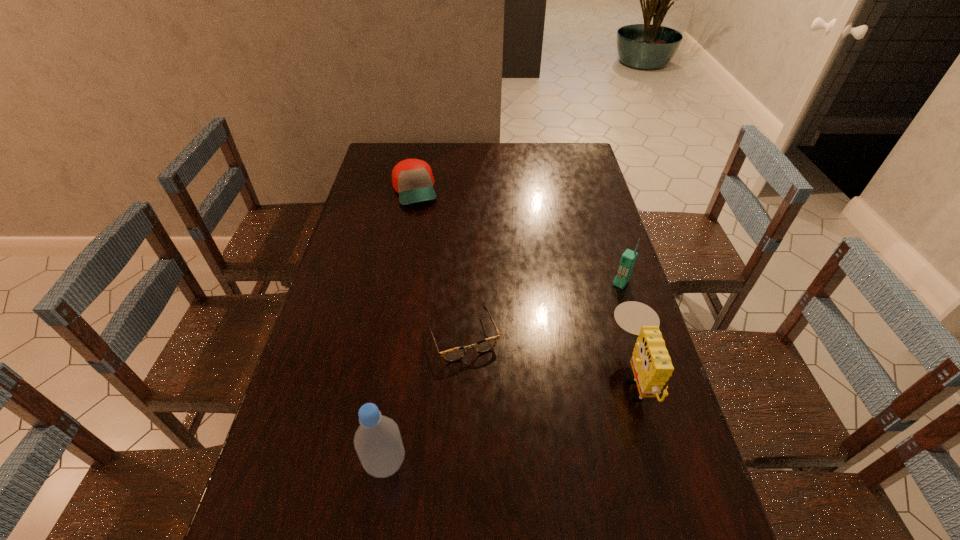
Where is `free space on the desktop that is between the bottle and the sponge and is positioned at the brim of the baseball cap`? The height and width of the screenshot is (540, 960). free space on the desktop that is between the bottle and the sponge and is positioned at the brim of the baseball cap is located at coordinates (494, 424).

Find the location of a particular element. free space on the desktop that is between the tallest object and the sponge and is positioned on the frame of the third object from right to left is located at coordinates (499, 423).

What are the coordinates of `free spot on the desktop that is between the nearest object and the sponge and is positioned on the keypad of the cellular telephone` in the screenshot? It's located at (517, 416).